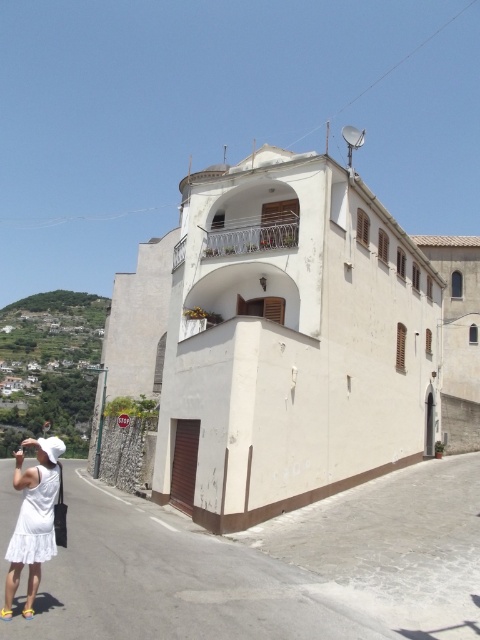
Does white cotton dress at lower left appear on the left side of white lace dress at lower left?

Indeed, white cotton dress at lower left is positioned on the left side of white lace dress at lower left.

Locate an element on the screen. white cotton dress at lower left is located at coordinates (33, 518).

Where is `white cotton dress at lower left`? This screenshot has height=640, width=480. white cotton dress at lower left is located at coordinates (33, 518).

Where is `white cotton dress at lower left`? white cotton dress at lower left is located at coordinates (33, 518).